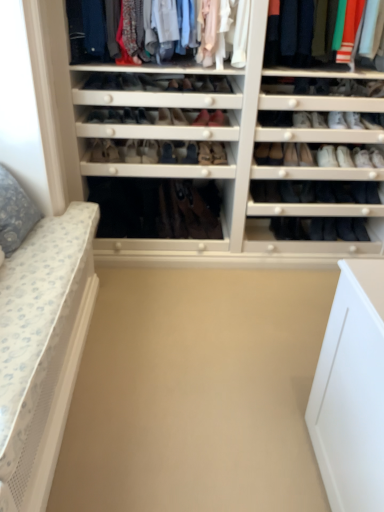
Question: From the image's perspective, relative to leather shoe at center, which appears as the 14th shoe when viewed from the left, is matte black shoe at center, the 15th shoe positioned from the left, above or below?

Choices:
 (A) below
 (B) above

Answer: (A)

Question: From a real-world perspective, is matte black shoe at center, which appears as the ninth shoe when viewed from the right, above or below leather shoe at center, which appears as the 14th shoe when viewed from the left?

Choices:
 (A) below
 (B) above

Answer: (A)

Question: Which of these objects is positioned farthest from the leather boots at center?

Choices:
 (A) leather shoe at center, marked as the 22th shoe in a right-to-left arrangement
 (B) gray dotted pillow at left
 (C) beige matte plain at center
 (D) matte black shoe at center, arranged as the 21th shoe when viewed from the right
 (E) matte fabric shirts at upper center, which is the 1th clothing in left-to-right order

Answer: (B)

Question: Which object is positioned closest to the matte black shoe at center, the 15th shoe positioned from the left?

Choices:
 (A) gray dotted pillow at left
 (B) leather tan boot at center, the 20th shoe when ordered from left to right
 (C) matte black shoe at center, which appears as the ninth shoe when viewed from the left
 (D) matte black shoe at center, the 6th shoe from the left
 (E) leather shoe at center, which appears as the 14th shoe when viewed from the left

Answer: (E)